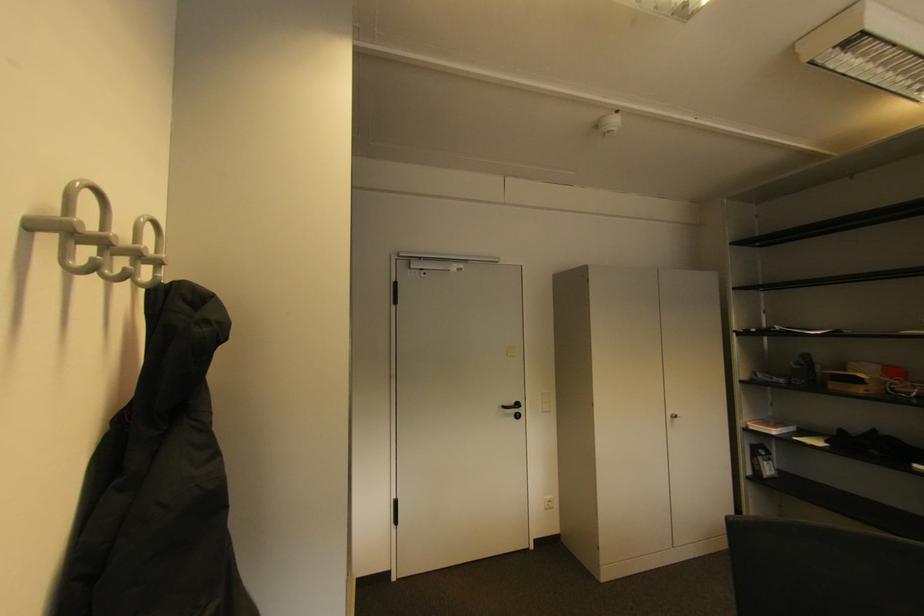
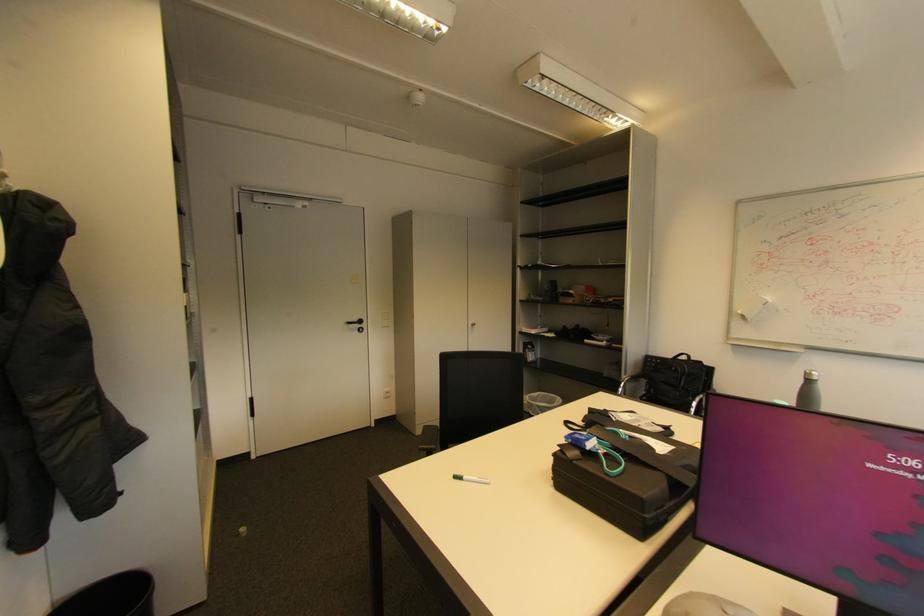
Locate, in the second image, the point that corresponds to [679,418] in the first image.

(479, 326)